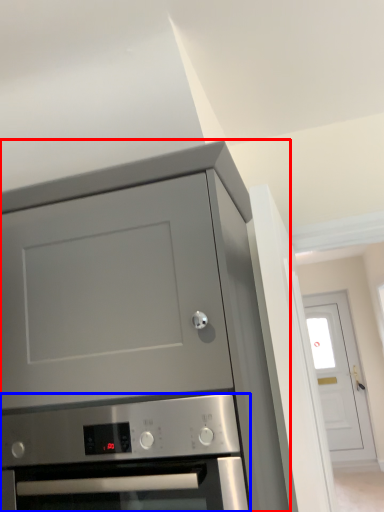
Question: Which of the following is the farthest to the observer, cabinetry (highlighted by a red box) or oven (highlighted by a blue box)?

Choices:
 (A) cabinetry
 (B) oven

Answer: (B)